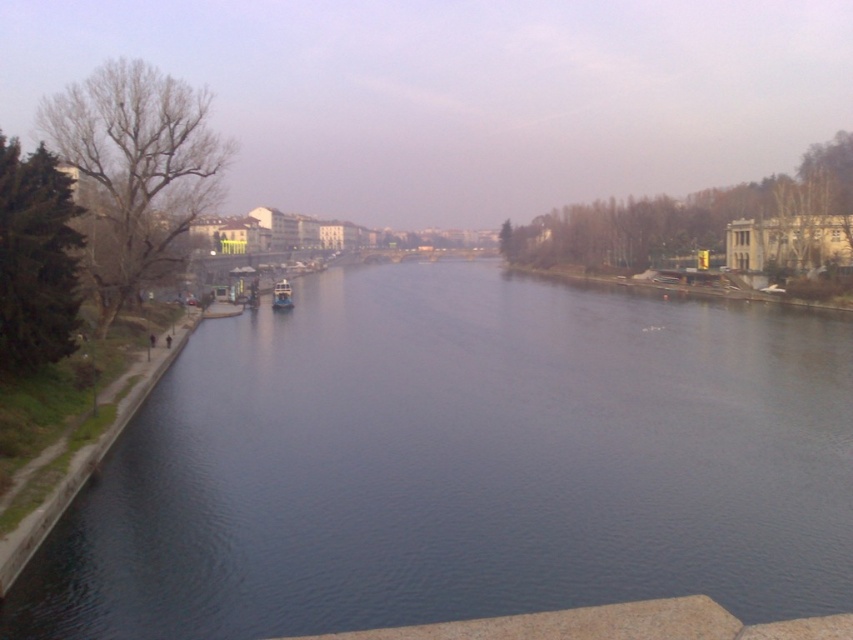
Question: Which point is closer to the camera taking this photo?

Choices:
 (A) (288, 289)
 (B) (740, 611)

Answer: (B)

Question: Can you confirm if dark blue water at center is bigger than blue metallic boat at center?

Choices:
 (A) yes
 (B) no

Answer: (A)

Question: Is dark blue water at center bigger than blue metallic boat at center?

Choices:
 (A) no
 (B) yes

Answer: (B)

Question: Observing the image, what is the correct spatial positioning of dark blue water at center in reference to blue metallic boat at center?

Choices:
 (A) above
 (B) below

Answer: (B)